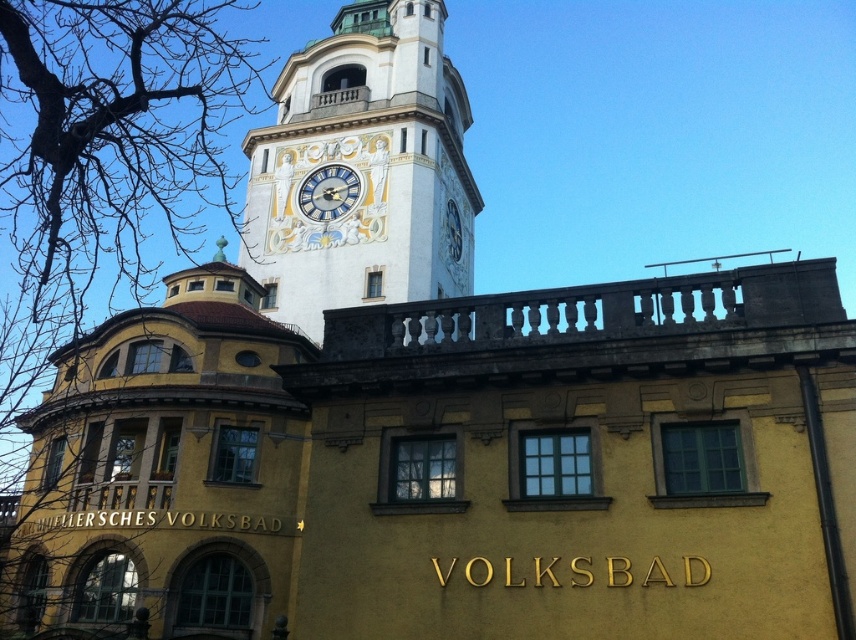
Question: Which point is farther from the camera taking this photo?

Choices:
 (A) (299, 204)
 (B) (390, 209)
 (C) (13, 24)

Answer: (A)

Question: Is bare branches at upper left above gold textured clock at center?

Choices:
 (A) no
 (B) yes

Answer: (B)

Question: Can you confirm if bare branches at upper left is positioned above white painted stone clock tower at upper center?

Choices:
 (A) yes
 (B) no

Answer: (A)

Question: Is white painted stone clock tower at upper center closer to camera compared to gold textured clock at center?

Choices:
 (A) yes
 (B) no

Answer: (A)

Question: Which point is closer to the camera?

Choices:
 (A) (376, 12)
 (B) (70, 234)
 (C) (301, 211)

Answer: (C)

Question: Which object is positioned farthest from the gold textured clock at center?

Choices:
 (A) bare branches at upper left
 (B) white painted stone clock tower at upper center

Answer: (A)